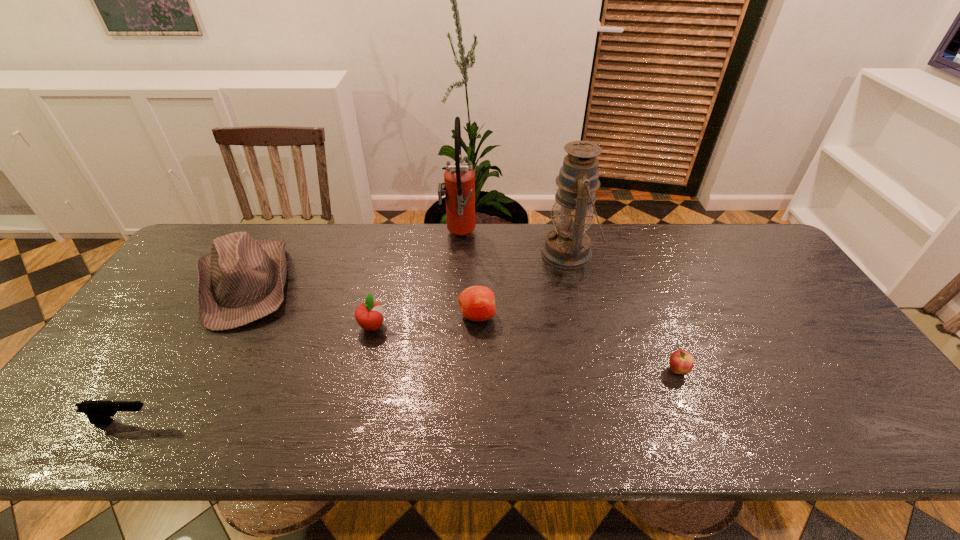
The width and height of the screenshot is (960, 540). What are the coordinates of `pistol at the left edge` in the screenshot? It's located at (98, 412).

I want to click on object that is at the far left corner, so click(x=242, y=280).

The image size is (960, 540). I want to click on object present at the near left corner, so click(x=98, y=412).

In the image, there is a desktop. Find the location of `free space at the far edge`. free space at the far edge is located at coordinates (296, 269).

The image size is (960, 540). Identify the location of vacant space at the near edge of the desktop. (578, 413).

Where is `free space at the left edge of the desktop`? free space at the left edge of the desktop is located at coordinates (193, 281).

At what (x,y) coordinates should I click in order to perform the action: click on free spot at the right edge of the desktop. Please return your answer as a coordinate pair (x, y). Looking at the image, I should click on (821, 383).

This screenshot has height=540, width=960. In the image, there is a desktop. In order to click on vacant space at the far left corner in this screenshot , I will do `click(249, 226)`.

The width and height of the screenshot is (960, 540). I want to click on free space at the near right corner of the desktop, so click(x=859, y=413).

The image size is (960, 540). Identify the location of free space between the fedora and the fire extinguisher. (352, 260).